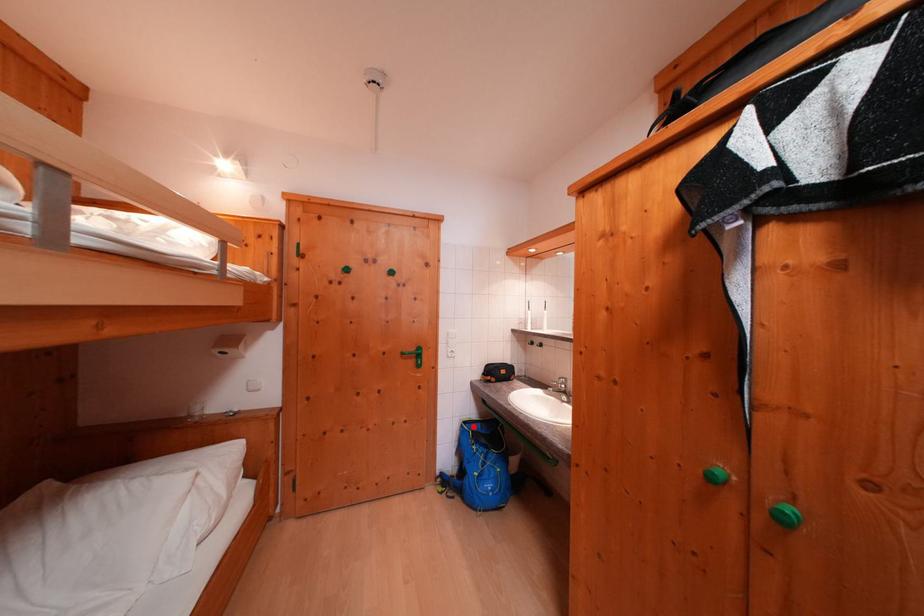
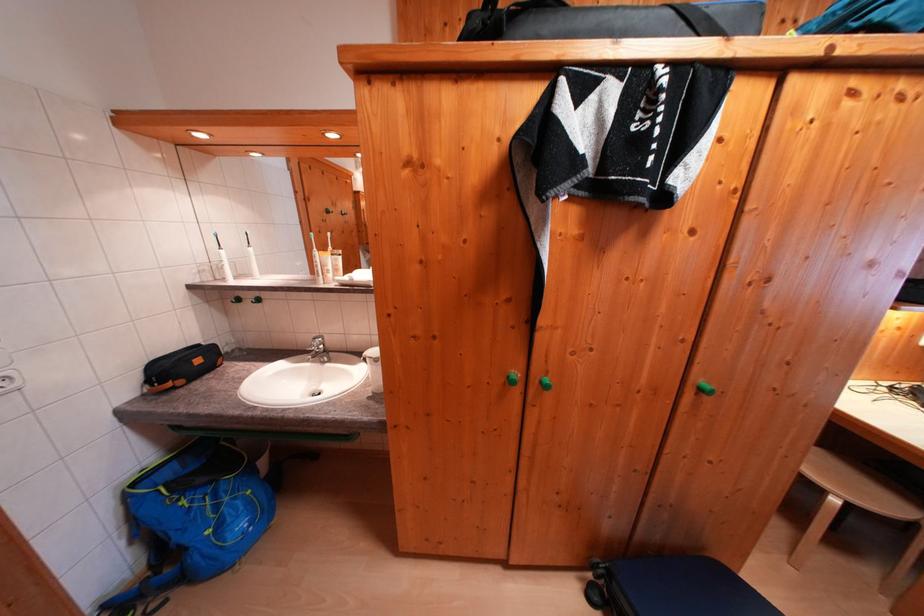
Locate, in the second image, the point that corresponds to the highlighted location in the first image.

(142, 488)